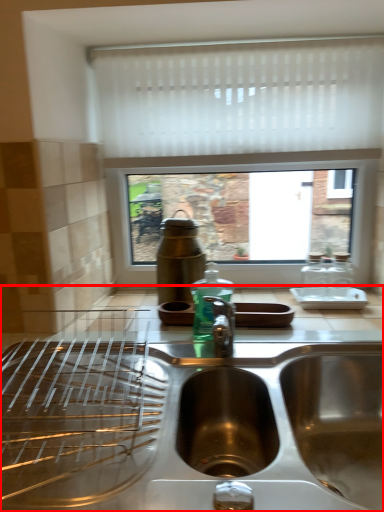
Question: Considering the relative positions of countertop (annotated by the red box) and curtain in the image provided, where is countertop (annotated by the red box) located with respect to the staircase?

Choices:
 (A) left
 (B) right

Answer: (A)